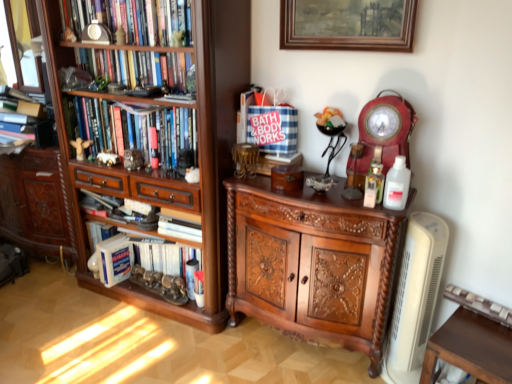
Where is `vacant space in between polished wood cabinet at center and wooden bookshelf at left`? Image resolution: width=512 pixels, height=384 pixels. vacant space in between polished wood cabinet at center and wooden bookshelf at left is located at coordinates (269, 356).